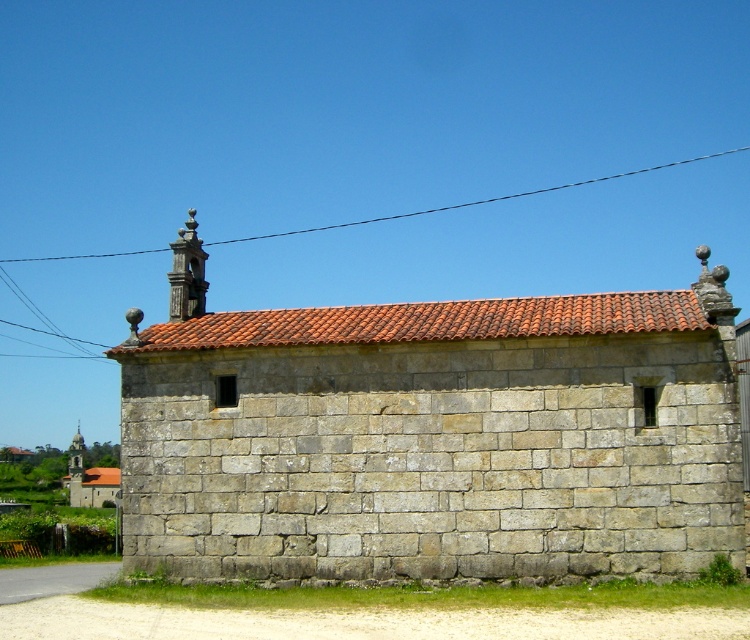
Is black wire at upper center above stone church at left?

Indeed, black wire at upper center is positioned over stone church at left.

Which of these two, black wire at upper center or stone church at left, stands taller?

black wire at upper center is taller.

Does point (388, 218) come farther from viewer compared to point (82, 442)?

That is True.

In order to click on black wire at upper center in this screenshot , I will do `click(477, 200)`.

Does gray stone chapel at center have a greater height compared to stone church at left?

Yes.

Does gray stone chapel at center lie behind stone church at left?

No, it is in front of stone church at left.

Identify the location of gray stone chapel at center. This screenshot has height=640, width=750. click(430, 436).

The width and height of the screenshot is (750, 640). In order to click on gray stone chapel at center in this screenshot , I will do `click(430, 436)`.

Is gray stone chapel at center to the left of black wire at upper center from the viewer's perspective?

No, gray stone chapel at center is not to the left of black wire at upper center.

Is point (567, 340) more distant than point (260, 237)?

No.

Identify the location of gray stone chapel at center. This screenshot has width=750, height=640. (430, 436).